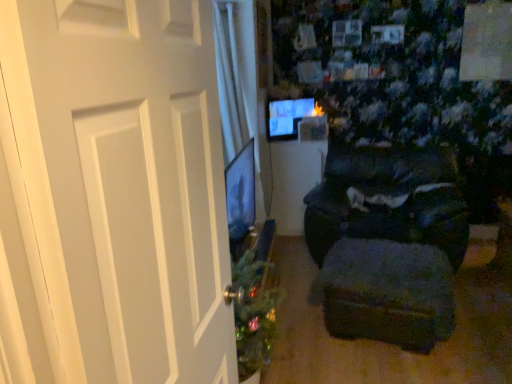
Question: Is dark fabric ottoman at lower right in contact with matte black table at center?

Choices:
 (A) yes
 (B) no

Answer: (B)

Question: From a real-world perspective, is dark fabric ottoman at lower right under matte black table at center?

Choices:
 (A) yes
 (B) no

Answer: (A)

Question: Can you confirm if dark fabric ottoman at lower right is shorter than matte black table at center?

Choices:
 (A) yes
 (B) no

Answer: (A)

Question: Is dark fabric ottoman at lower right wider than matte black table at center?

Choices:
 (A) no
 (B) yes

Answer: (B)

Question: Is dark fabric ottoman at lower right aimed at matte black table at center?

Choices:
 (A) yes
 (B) no

Answer: (B)

Question: Is matte black monitor at upper center in front of or behind dark fabric ottoman at lower right in the image?

Choices:
 (A) behind
 (B) front

Answer: (A)

Question: Looking at the image, does matte black monitor at upper center seem bigger or smaller compared to dark fabric ottoman at lower right?

Choices:
 (A) big
 (B) small

Answer: (B)

Question: Visually, is matte black monitor at upper center positioned to the left or to the right of dark fabric ottoman at lower right?

Choices:
 (A) right
 (B) left

Answer: (B)

Question: Would you say matte black monitor at upper center is inside or outside dark fabric ottoman at lower right?

Choices:
 (A) inside
 (B) outside

Answer: (B)

Question: Considering the positions of white matte door at left and matte black table at center in the image, is white matte door at left bigger or smaller than matte black table at center?

Choices:
 (A) small
 (B) big

Answer: (A)

Question: Based on their positions, is white matte door at left located to the left or right of matte black table at center?

Choices:
 (A) right
 (B) left

Answer: (B)

Question: In terms of height, does white matte door at left look taller or shorter compared to matte black table at center?

Choices:
 (A) tall
 (B) short

Answer: (A)

Question: Is white matte door at left wider or thinner than matte black table at center?

Choices:
 (A) wide
 (B) thin

Answer: (B)

Question: In terms of width, does matte black monitor at upper center look wider or thinner when compared to white matte door at left?

Choices:
 (A) thin
 (B) wide

Answer: (A)

Question: Based on their positions, is matte black monitor at upper center located to the left or right of white matte door at left?

Choices:
 (A) left
 (B) right

Answer: (B)